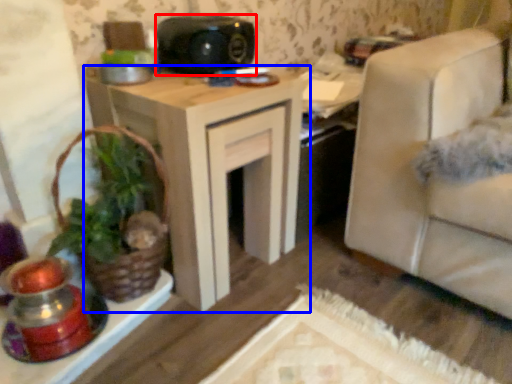
Question: Among these objects, which one is nearest to the camera, speaker (highlighted by a red box) or table (highlighted by a blue box)?

Choices:
 (A) speaker
 (B) table

Answer: (B)